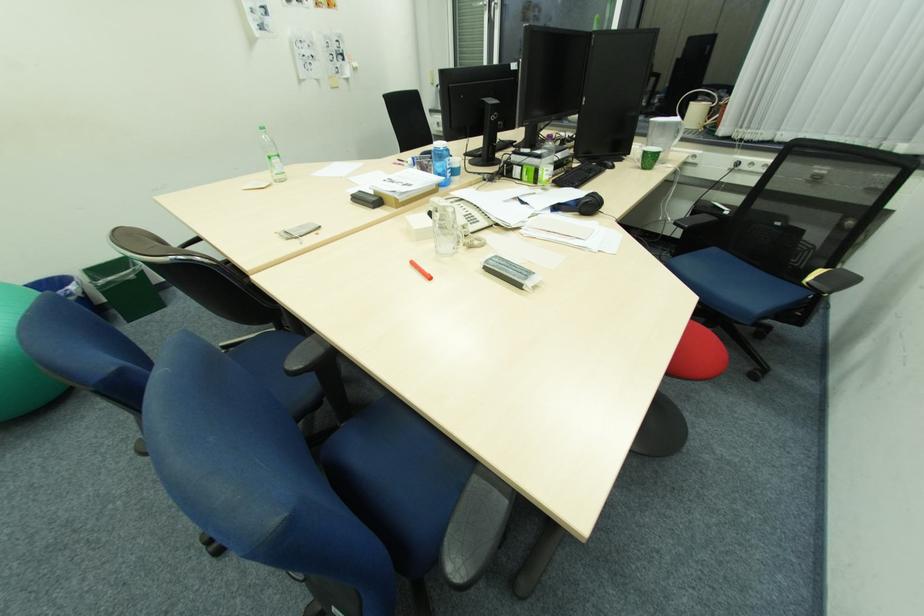
You are a GUI agent. You are given a task and a screenshot of the screen. Output one action in this format:
    pyautogui.click(x=<x>, y=<y>)
    Task: Click on the glass mug handle
    
    Given the screenshot: What is the action you would take?
    pyautogui.click(x=634, y=156)